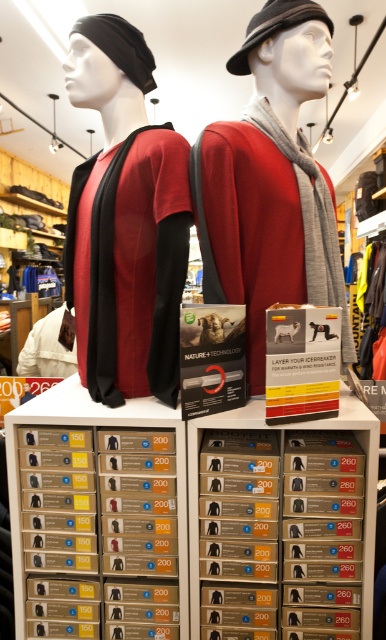
Question: Which of the following is the closest to the observer?

Choices:
 (A) gray wool scarf at center
 (B) white fabric shirt at center
 (C) black felt hat at upper center
 (D) black fabric beanie at upper left

Answer: (A)

Question: Which of the following is the farthest from the observer?

Choices:
 (A) matte black t-shirt at left
 (B) black fabric beanie at upper left
 (C) white fabric shirt at center
 (D) gray wool scarf at center

Answer: (C)

Question: Which object is the closest to the black felt hat at upper center?

Choices:
 (A) gray wool scarf at center
 (B) white fabric shirt at center

Answer: (A)

Question: Does gray wool scarf at center appear on the right side of white fabric shirt at center?

Choices:
 (A) yes
 (B) no

Answer: (A)

Question: Observing the image, what is the correct spatial positioning of matte black t-shirt at left in reference to black fabric beanie at upper left?

Choices:
 (A) below
 (B) above

Answer: (A)

Question: Can you confirm if black fabric beanie at upper left is positioned to the left of white fabric shirt at center?

Choices:
 (A) no
 (B) yes

Answer: (A)